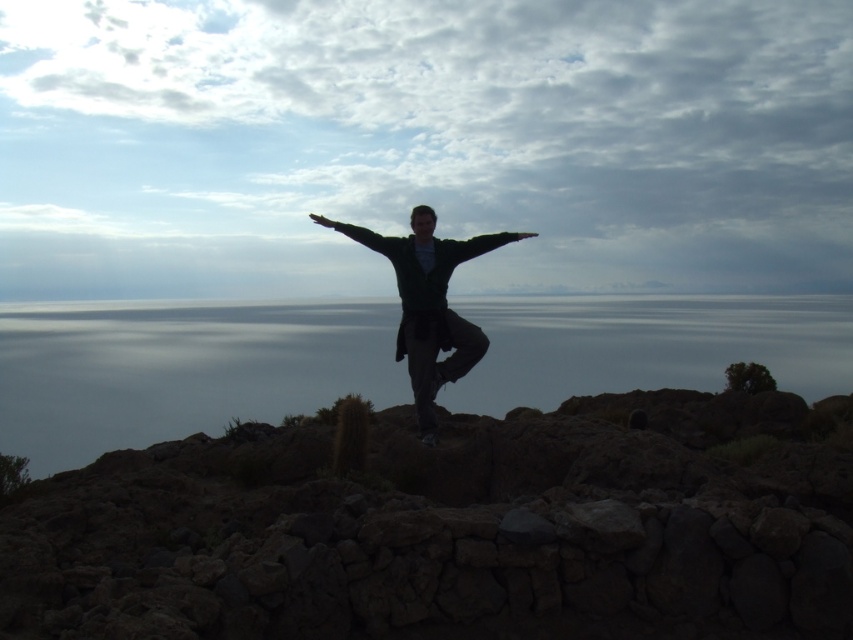
You are a drone operator tasked with capturing aerial footage of the scene. The drone has a maximum flight range of 50 feet from its starting point. If you position the drone above the dark stone wall at center, will it be able to fly to the gray water at center without exceeding its range?

The distance between the dark stone wall at center and the gray water at center is 45.55 feet, which is within the drone operator drone operator drone operator drone operator drone operator drone operator drone operator drone operator drone operator drone operator drone operator drone operator drone operator drone operator drone operator drone operator drone operator drone operator drone operator drone operator drone operator drone operator drone operator drone operator drone operator drone operator drone o

Based on the photo, you are a photographer trying to capture the dark stone wall at center and the dark green sweater at center in the same frame. Since both are at the center, which one will appear larger in the photo?

The dark stone wall at center will appear larger in the photo because it is closer to the viewer than the dark green sweater at center.

You are standing at the point marked by the coordinates point [735,433]. You want to walk towards the sea in the background. Is the low stone wall in the bottom of the frame blocking your path? Please explain your reasoning based on the scene description.

The point [735,433] is 10.67 meters away from the viewer. Since the low stone wall is at the bottom of the frame, it is likely closer to the viewer than the point. Therefore, the low stone wall may block the path towards the sea unless there is a gap or passage around it.